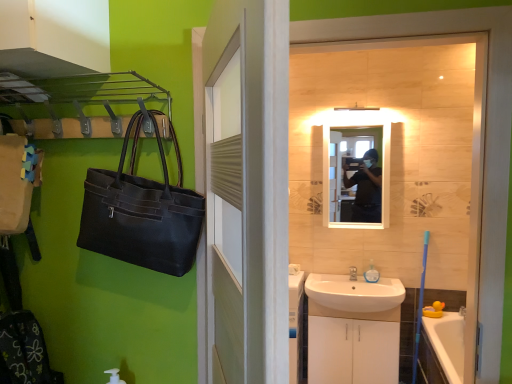
You are a GUI agent. You are given a task and a screenshot of the screen. Output one action in this format:
    pyautogui.click(x=<x>, y=<y>)
    Task: Click on the free space to the right of translucent plastic soap dispenser at sink
    
    Given the screenshot: What is the action you would take?
    pyautogui.click(x=389, y=281)